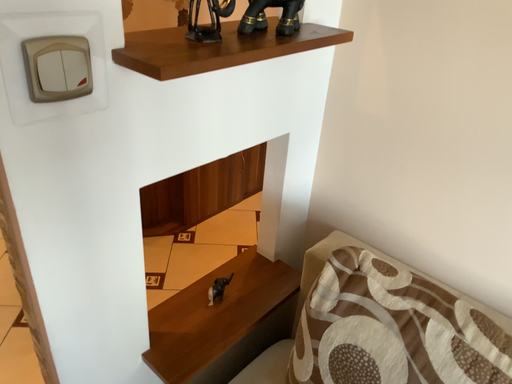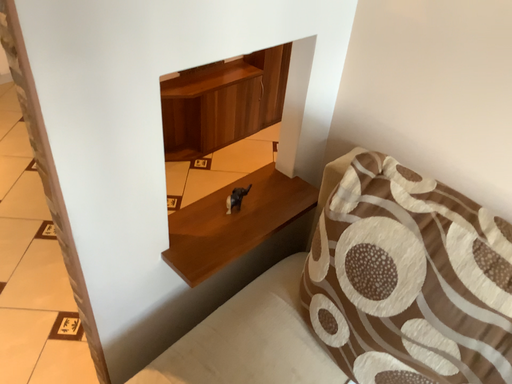
Question: Which way did the camera rotate in the video?

Choices:
 (A) rotated downward
 (B) rotated upward

Answer: (A)